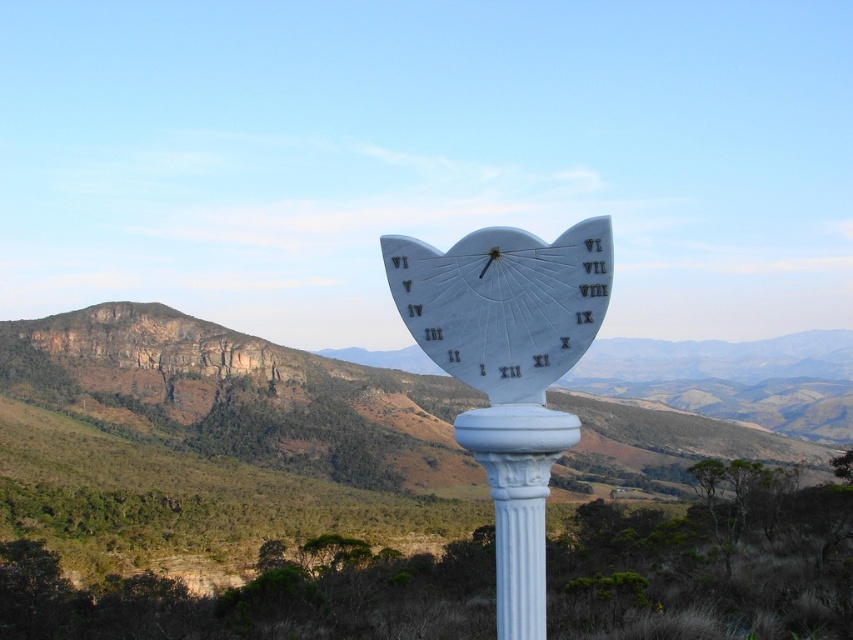
Question: Which is nearer to the white marble pillar at center?

Choices:
 (A) white glossy heart at center
 (B) white stone sundial at center
 (C) matte white sundial at center

Answer: (B)

Question: Does matte white sundial at center have a greater width compared to white marble pillar at center?

Choices:
 (A) no
 (B) yes

Answer: (B)

Question: Among these points, which one is nearest to the camera?

Choices:
 (A) (537, 280)
 (B) (531, 403)
 (C) (503, 365)
 (D) (339, 540)

Answer: (A)

Question: Observing the image, what is the correct spatial positioning of white stone sundial at center in reference to white glossy heart at center?

Choices:
 (A) above
 (B) below

Answer: (B)

Question: Which object appears farthest from the camera in this image?

Choices:
 (A) white glossy heart at center
 (B) white marble pillar at center

Answer: (B)

Question: Can you confirm if white stone sundial at center is positioned above white marble pillar at center?

Choices:
 (A) yes
 (B) no

Answer: (A)